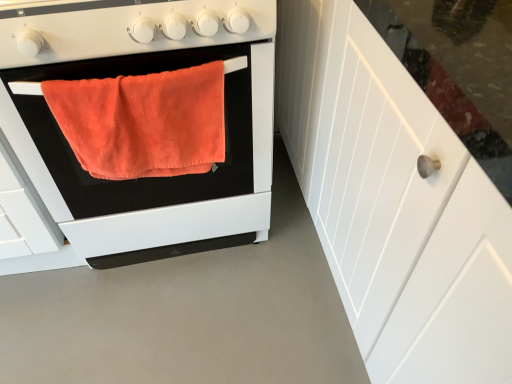
Question: Visually, is orange fabric towel at left positioned to the left or to the right of orange plush towel at center?

Choices:
 (A) left
 (B) right

Answer: (A)

Question: Considering the positions of point (258, 155) and point (105, 110), is point (258, 155) closer or farther from the camera than point (105, 110)?

Choices:
 (A) farther
 (B) closer

Answer: (A)

Question: Based on their relative distances, which object is nearer to the matte white gas stove at center?

Choices:
 (A) orange fabric towel at left
 (B) orange plush towel at center
 (C) white wood cabinet at right

Answer: (B)

Question: Estimate the real-world distances between objects in this image. Which object is farther from the matte white gas stove at center?

Choices:
 (A) orange plush towel at center
 (B) white wood cabinet at right
 (C) orange fabric towel at left

Answer: (B)